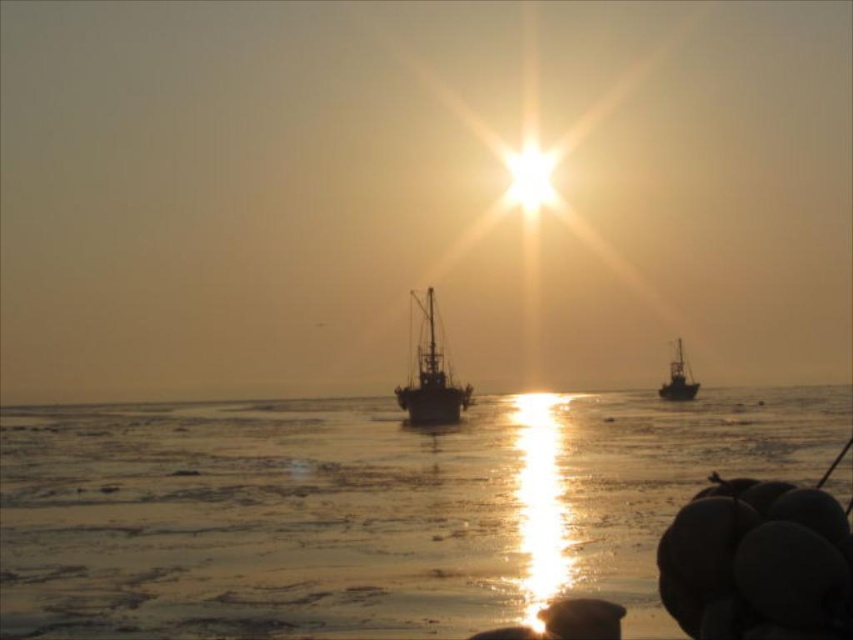
Question: Is the position of dark gray metallic boat at center less distant than that of silvery metallic boat at right?

Choices:
 (A) no
 (B) yes

Answer: (B)

Question: Which point is closer to the camera?

Choices:
 (A) (480, 497)
 (B) (450, 387)
 (C) (686, 387)

Answer: (A)

Question: Is translucent ice at center to the left of silvery metallic boat at right from the viewer's perspective?

Choices:
 (A) yes
 (B) no

Answer: (A)

Question: Does translucent ice at center appear on the right side of silvery metallic boat at right?

Choices:
 (A) yes
 (B) no

Answer: (B)

Question: Which object is the farthest from the silvery metallic boat at right?

Choices:
 (A) dark gray metallic boat at center
 (B) translucent ice at center

Answer: (B)

Question: Which of the following is the farthest from the observer?

Choices:
 (A) (676, 365)
 (B) (299, 508)

Answer: (A)